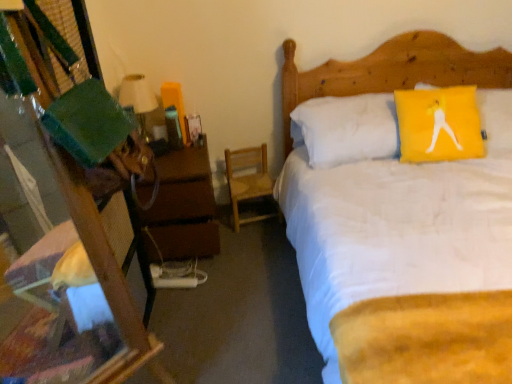
Question: Considering the relative sizes of matte white lampshade at left and wooden desk at left in the image provided, is matte white lampshade at left wider than wooden desk at left?

Choices:
 (A) no
 (B) yes

Answer: (A)

Question: Considering the relative positions of matte white lampshade at left and wooden desk at left in the image provided, is matte white lampshade at left to the left of wooden desk at left from the viewer's perspective?

Choices:
 (A) yes
 (B) no

Answer: (A)

Question: Is matte white lampshade at left surrounding wooden desk at left?

Choices:
 (A) no
 (B) yes

Answer: (A)

Question: Does matte white lampshade at left have a smaller size compared to wooden desk at left?

Choices:
 (A) no
 (B) yes

Answer: (B)

Question: From a real-world perspective, is matte white lampshade at left under wooden desk at left?

Choices:
 (A) yes
 (B) no

Answer: (A)

Question: Considering their positions, is white soft bed at upper right located in front of or behind wooden chair at center?

Choices:
 (A) behind
 (B) front

Answer: (B)

Question: In terms of height, does white soft bed at upper right look taller or shorter compared to wooden chair at center?

Choices:
 (A) tall
 (B) short

Answer: (A)

Question: Is white soft bed at upper right wider or thinner than wooden chair at center?

Choices:
 (A) thin
 (B) wide

Answer: (B)

Question: Based on their sizes in the image, would you say white soft bed at upper right is bigger or smaller than wooden chair at center?

Choices:
 (A) small
 (B) big

Answer: (B)

Question: From the image's perspective, is wooden chair at center above or below wooden desk at left?

Choices:
 (A) below
 (B) above

Answer: (B)

Question: Is wooden chair at center bigger or smaller than wooden desk at left?

Choices:
 (A) small
 (B) big

Answer: (A)

Question: Does point (256, 221) appear closer or farther from the camera than point (122, 337)?

Choices:
 (A) farther
 (B) closer

Answer: (A)

Question: Is wooden chair at center to the left or to the right of wooden desk at left in the image?

Choices:
 (A) right
 (B) left

Answer: (A)

Question: Is wooden desk at left taller or shorter than matte white lampshade at left?

Choices:
 (A) tall
 (B) short

Answer: (A)

Question: Relative to matte white lampshade at left, is wooden desk at left in front or behind?

Choices:
 (A) behind
 (B) front

Answer: (B)